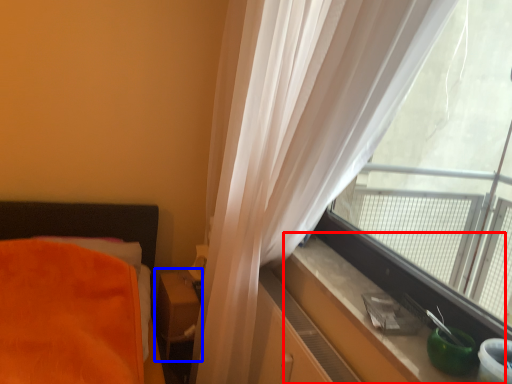
Question: Among these objects, which one is nearest to the camera, window sill (highlighted by a red box) or table (highlighted by a blue box)?

Choices:
 (A) window sill
 (B) table

Answer: (A)